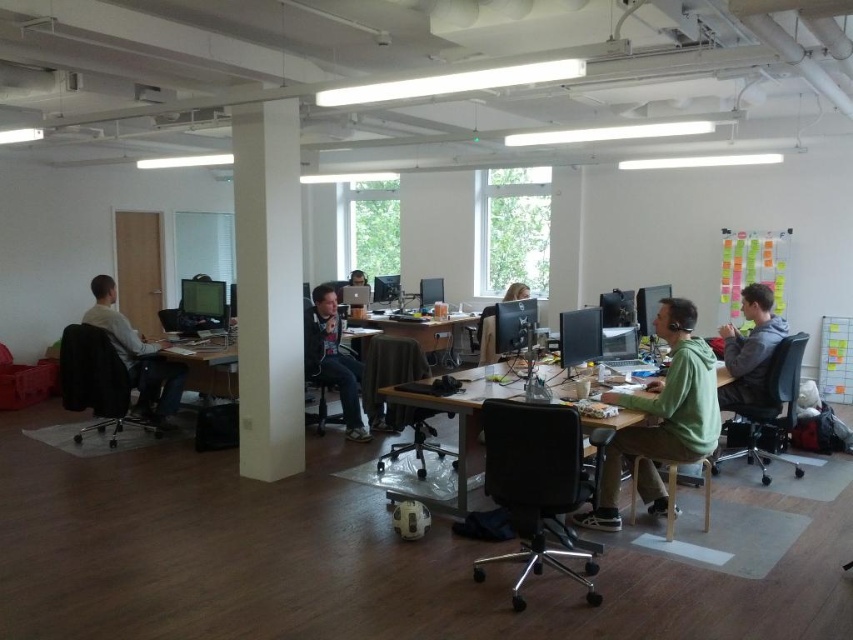
Describe the element at coordinates (750, 348) in the screenshot. The width and height of the screenshot is (853, 640). I see `gray hoodie at right` at that location.

Does point (764, 301) come behind point (357, 381)?

No, it is not.

Locate an element on the screen. Image resolution: width=853 pixels, height=640 pixels. gray hoodie at right is located at coordinates (750, 348).

Is gray hoodie at right bigger than wooden desk at center?

Actually, gray hoodie at right might be smaller than wooden desk at center.

Can you confirm if gray hoodie at right is positioned to the left of wooden desk at center?

No, gray hoodie at right is not to the left of wooden desk at center.

Identify the location of gray hoodie at right. Image resolution: width=853 pixels, height=640 pixels. coord(750,348).

Which of these two, green matte hoodie at center or matte gray hoodie at left, stands shorter?

Standing shorter between the two is matte gray hoodie at left.

Looking at this image, between green matte hoodie at center and matte gray hoodie at left, which one appears on the right side from the viewer's perspective?

green matte hoodie at center

Does point (670, 422) lie behind point (91, 285)?

No, it is in front of (91, 285).

Locate an element on the screen. The image size is (853, 640). green matte hoodie at center is located at coordinates (660, 419).